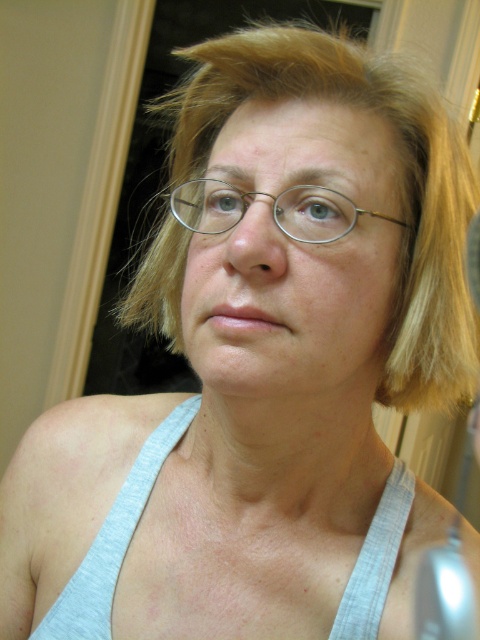
You are an interior designer analyzing the placement of objects in the room. The point at coordinates point (294, 250) is where the matte silver glasses at center are located. If you were to place a new decorative item on the desk in front of the door frame, where should it be positioned relative to the matte silver glasses at center to maintain visual balance?

The new decorative item should be placed symmetrically opposite to the matte silver glasses at center at point (294, 250) to achieve visual balance.

You are a optometrist examining two pairs of glasses on a patient. The glasses are matte silver glasses at center and metallic wireframe glasses at center. Which pair has a wider frame?

The matte silver glasses at center has a larger width than the metallic wireframe glasses at center, so the matte silver glasses at center has a wider frame.

You are a fashion designer analyzing this image. You need to determine the spatial arrangement of the gray fabric vest at center and the metallic wireframe glasses at center. Which object is located to the left of the other?

The gray fabric vest at center is positioned on the left side of metallic wireframe glasses at center, so the gray fabric vest at center is to the left of the metallic wireframe glasses at center.